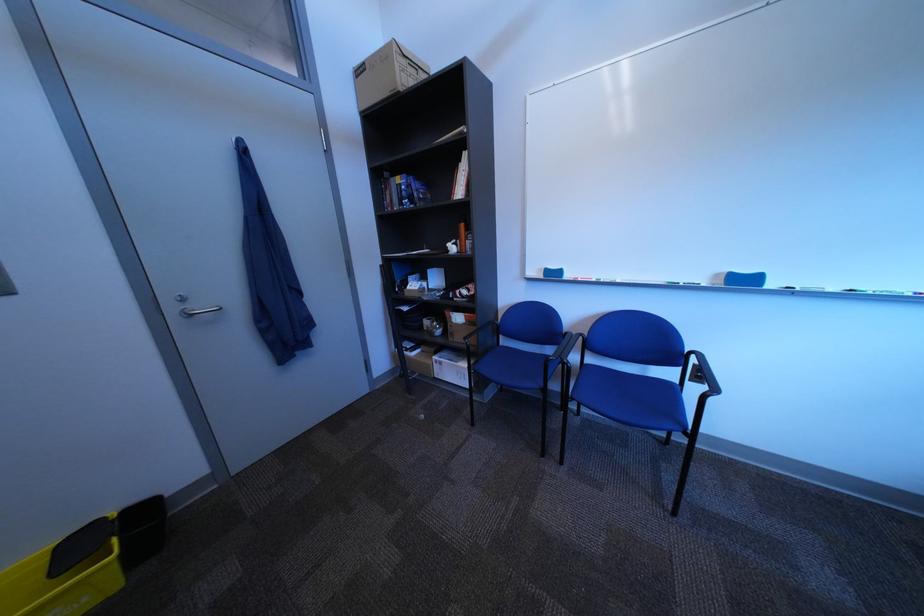
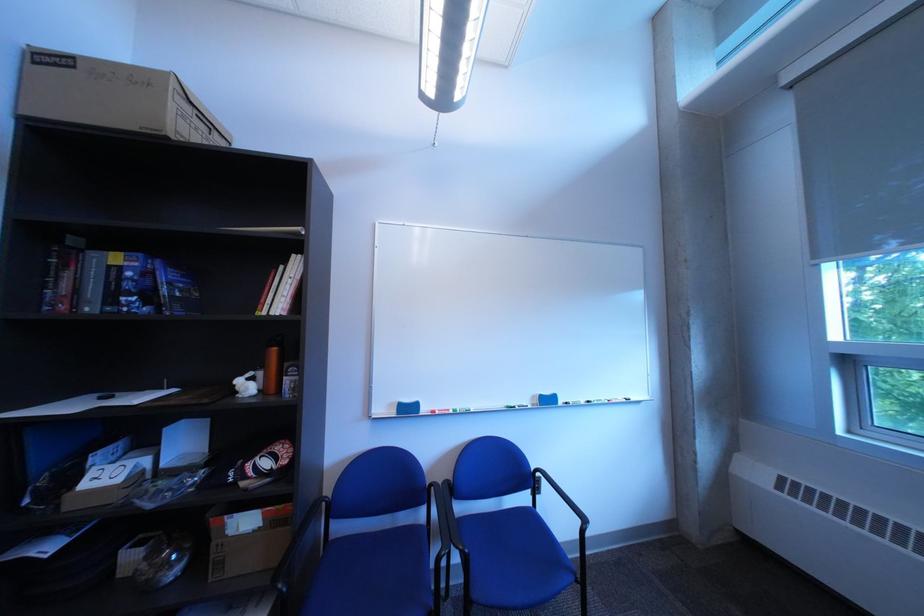
The point at [421,203] is marked in the first image. Where is the corresponding point in the second image?

(150, 300)